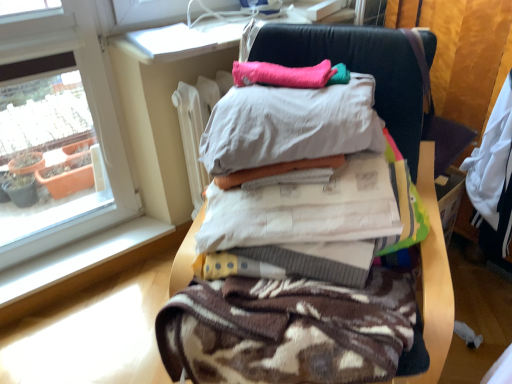
Question: Can we say dark blue leather chair at right lies outside pink fabric pillow at upper center?

Choices:
 (A) yes
 (B) no

Answer: (A)

Question: Can you confirm if dark blue leather chair at right is taller than pink fabric pillow at upper center?

Choices:
 (A) yes
 (B) no

Answer: (A)

Question: Is dark blue leather chair at right shorter than pink fabric pillow at upper center?

Choices:
 (A) yes
 (B) no

Answer: (B)

Question: Considering the relative positions of dark blue leather chair at right and pink fabric pillow at upper center in the image provided, is dark blue leather chair at right to the left of pink fabric pillow at upper center from the viewer's perspective?

Choices:
 (A) yes
 (B) no

Answer: (B)

Question: Is dark blue leather chair at right looking in the opposite direction of pink fabric pillow at upper center?

Choices:
 (A) yes
 (B) no

Answer: (B)

Question: Considering the positions of point (457, 135) and point (231, 379), is point (457, 135) closer or farther from the camera than point (231, 379)?

Choices:
 (A) farther
 (B) closer

Answer: (A)

Question: Relative to brown textured blanket at center, is dark blue leather chair at right in front or behind?

Choices:
 (A) behind
 (B) front

Answer: (A)

Question: Considering the positions of dark blue leather chair at right and brown textured blanket at center in the image, is dark blue leather chair at right bigger or smaller than brown textured blanket at center?

Choices:
 (A) small
 (B) big

Answer: (A)

Question: Is dark blue leather chair at right wider or thinner than brown textured blanket at center?

Choices:
 (A) thin
 (B) wide

Answer: (A)

Question: Based on their sizes in the image, would you say brown textured blanket at center is bigger or smaller than pink fabric pillow at upper center?

Choices:
 (A) small
 (B) big

Answer: (B)

Question: From the image's perspective, is brown textured blanket at center located above or below pink fabric pillow at upper center?

Choices:
 (A) above
 (B) below

Answer: (B)

Question: From a real-world perspective, relative to pink fabric pillow at upper center, is brown textured blanket at center vertically above or below?

Choices:
 (A) above
 (B) below

Answer: (B)

Question: In the image, is brown textured blanket at center positioned in front of or behind pink fabric pillow at upper center?

Choices:
 (A) behind
 (B) front

Answer: (B)

Question: Considering the positions of brown textured blanket at center and dark blue leather chair at right in the image, is brown textured blanket at center bigger or smaller than dark blue leather chair at right?

Choices:
 (A) big
 (B) small

Answer: (A)

Question: From their relative heights in the image, would you say brown textured blanket at center is taller or shorter than dark blue leather chair at right?

Choices:
 (A) short
 (B) tall

Answer: (B)